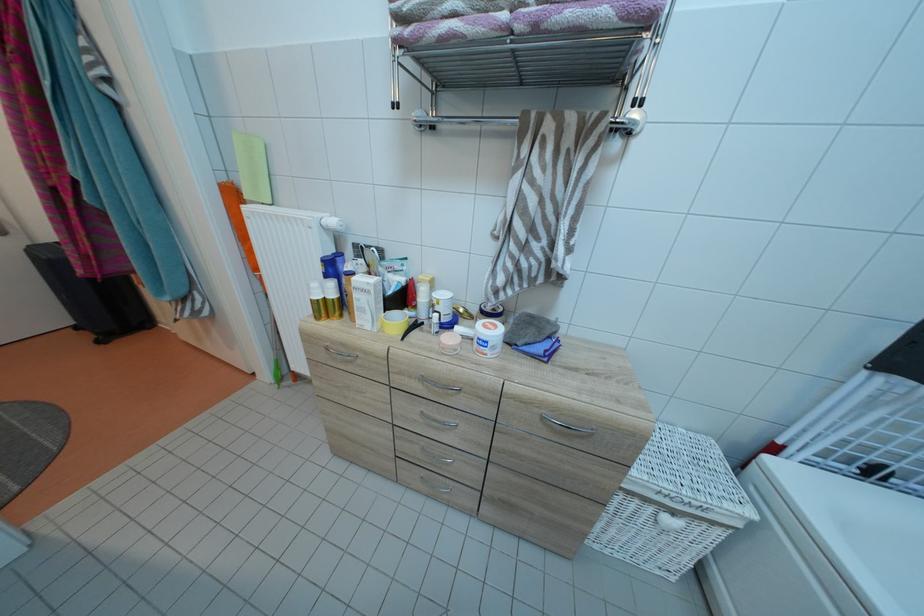
Image resolution: width=924 pixels, height=616 pixels. In order to click on towel rack bar in this screenshot , I will do `click(527, 121)`.